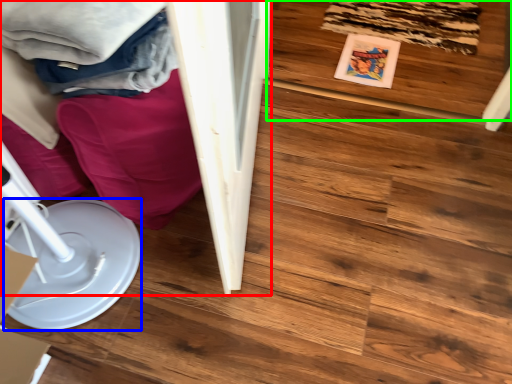
Question: Based on their relative distances, which object is farther from furniture (highlighted by a red box)? Choose from paper plate (highlighted by a blue box) and wood (highlighted by a green box).

Choices:
 (A) paper plate
 (B) wood

Answer: (B)